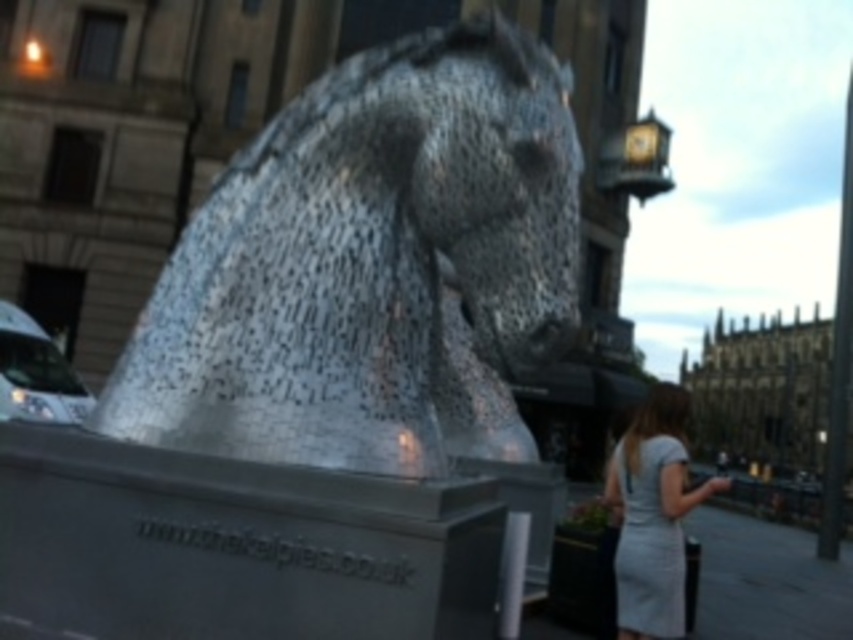
You are standing at the center of the urban square and want to take a photo of the shiny metallic horse at center. The camera app on your phone shows a grid with coordinates. Where should you position yourself to capture the horse exactly at the center of the photo?

The shiny metallic horse at center is located at coordinates point [370,268]. To capture it exactly at the center of the photo, you should position yourself so that the crosshairs on your camera app align with these coordinates.

You are standing in front of the metallic horse head sculpture and see two points marked in the scene. The first point is at coordinates point (520, 67) and the second is at point (666, 426). Which point is closer to you?

Point (520, 67) is in front of point (666, 426), so it is closer to you.

You are a photographer standing in front of the shiny metallic horse at center. You notice a light gray dress at lower right. Which object is taller?

The light gray dress at lower right is taller than the shiny metallic horse at center.